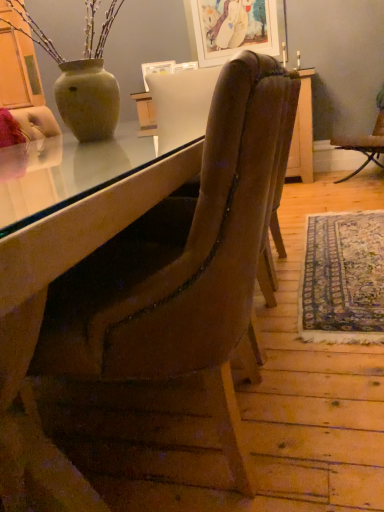
Where is `brown leather chair at right, the 1th chair in the back-to-front sequence`? This screenshot has width=384, height=512. brown leather chair at right, the 1th chair in the back-to-front sequence is located at coordinates (364, 145).

You are a GUI agent. You are given a task and a screenshot of the screen. Output one action in this format:
    pyautogui.click(x=<x>, y=<y>)
    Task: Click on the velvet brown chair at center, positioned as the second chair in right-to-left order
    The height and width of the screenshot is (512, 384).
    Given the screenshot: What is the action you would take?
    [143, 289]

Which object is positioned more to the right, blue patterned rug at lower right or matte white picture frame at upper center?

From the viewer's perspective, blue patterned rug at lower right appears more on the right side.

From the image's perspective, between blue patterned rug at lower right and matte white picture frame at upper center, which one is located above?

matte white picture frame at upper center appears higher in the image.

Between point (321, 289) and point (189, 34), which one is positioned in front?

The point (321, 289) is closer.

Would you say brown leather chair at right, arranged as the 1th chair when viewed from the top, is to the left or to the right of velvet brown chair at center, which is the first chair in left-to-right order, in the picture?

Clearly, brown leather chair at right, arranged as the 1th chair when viewed from the top, is on the right of velvet brown chair at center, which is the first chair in left-to-right order, in the image.

How much distance is there between brown leather chair at right, arranged as the second chair when ordered from the bottom, and velvet brown chair at center, which ranks as the first chair in front-to-back order?

The distance of brown leather chair at right, arranged as the second chair when ordered from the bottom, from velvet brown chair at center, which ranks as the first chair in front-to-back order, is 3.29 meters.

From the image's perspective, which one is positioned higher, brown leather chair at right, the second chair viewed from the front, or velvet brown chair at center, positioned as the second chair in right-to-left order?

brown leather chair at right, the second chair viewed from the front, is shown above in the image.

From the picture: Is brown leather chair at right, the second chair viewed from the front, not within velvet brown chair at center, marked as the second chair in a back-to-front arrangement?

Absolutely, brown leather chair at right, the second chair viewed from the front, is external to velvet brown chair at center, marked as the second chair in a back-to-front arrangement.

The height and width of the screenshot is (512, 384). I want to click on chair below the blue patterned rug at lower right (from the image's perspective), so click(143, 289).

From a real-world perspective, is blue patterned rug at lower right located beneath velvet brown chair at center, positioned as the second chair in right-to-left order?

Yes.

From the image's perspective, relative to velvet brown chair at center, marked as the second chair in a back-to-front arrangement, is blue patterned rug at lower right above or below?

blue patterned rug at lower right is above velvet brown chair at center, marked as the second chair in a back-to-front arrangement.

Which object is closer to the camera, blue patterned rug at lower right or velvet brown chair at center, marked as the second chair in a back-to-front arrangement?

velvet brown chair at center, marked as the second chair in a back-to-front arrangement.

Consider the image. Considering the sizes of objects blue patterned rug at lower right and brown leather chair at right, arranged as the second chair when ordered from the bottom, in the image provided, who is wider, blue patterned rug at lower right or brown leather chair at right, arranged as the second chair when ordered from the bottom,?

brown leather chair at right, arranged as the second chair when ordered from the bottom.

Is blue patterned rug at lower right smaller than brown leather chair at right, the second chair viewed from the front?

Indeed, blue patterned rug at lower right has a smaller size compared to brown leather chair at right, the second chair viewed from the front.

Does point (336, 327) come in front of point (375, 125)?

Yes, it is in front of point (375, 125).

From a real-world perspective, between matte white picture frame at upper center and brown leather chair at right, arranged as the 1th chair when viewed from the top, who is vertically lower?

brown leather chair at right, arranged as the 1th chair when viewed from the top, from a real-world perspective.

Based on the photo, does matte white picture frame at upper center have a lesser height compared to brown leather chair at right, arranged as the second chair when ordered from the bottom?

Yes.

Which of these two, matte white picture frame at upper center or brown leather chair at right, the 1th chair in the back-to-front sequence, is thinner?

Thinner between the two is matte white picture frame at upper center.

From the image's perspective, is matte white picture frame at upper center above or below brown leather chair at right, arranged as the second chair when ordered from the bottom?

Clearly, from the image's perspective, matte white picture frame at upper center is above brown leather chair at right, arranged as the second chair when ordered from the bottom.

Is brown leather chair at right, arranged as the second chair when ordered from the bottom, not near matte white picture frame at upper center?

That's right, there is a large distance between brown leather chair at right, arranged as the second chair when ordered from the bottom, and matte white picture frame at upper center.

From the image's perspective, relative to matte white picture frame at upper center, is brown leather chair at right, arranged as the 1th chair when viewed from the top, above or below?

From the image's perspective, brown leather chair at right, arranged as the 1th chair when viewed from the top, appears below matte white picture frame at upper center.

Can you confirm if brown leather chair at right, arranged as the second chair when ordered from the bottom, is positioned to the right of matte white picture frame at upper center?

Yes.

Is brown leather chair at right, the second chair viewed from the left, oriented towards matte white picture frame at upper center?

No, brown leather chair at right, the second chair viewed from the left, is not turned towards matte white picture frame at upper center.

Is matte white picture frame at upper center positioned before velvet brown chair at center, which appears as the first chair when ordered from the bottom?

No, matte white picture frame at upper center is behind velvet brown chair at center, which appears as the first chair when ordered from the bottom.

Is matte white picture frame at upper center placed right next to velvet brown chair at center, which appears as the first chair when ordered from the bottom?

No, matte white picture frame at upper center is not beside velvet brown chair at center, which appears as the first chair when ordered from the bottom.

Would you say matte white picture frame at upper center is inside or outside velvet brown chair at center, which ranks as the first chair in front-to-back order?

The correct answer is: outside.

Is matte white picture frame at upper center thinner than velvet brown chair at center, marked as the second chair in a back-to-front arrangement?

Yes.

What are the coordinates of `mat located underneath the matte white picture frame at upper center (from a real-world perspective)` in the screenshot? It's located at (343, 279).

This screenshot has height=512, width=384. In order to click on chair that appears below the brown leather chair at right, arranged as the second chair when ordered from the bottom (from the image's perspective) in this screenshot , I will do pos(143,289).

When comparing their distances from blue patterned rug at lower right, does matte white picture frame at upper center or brown leather chair at right, arranged as the second chair when ordered from the bottom, seem closer?

The object closer to blue patterned rug at lower right is brown leather chair at right, arranged as the second chair when ordered from the bottom.

Based on their spatial positions, is blue patterned rug at lower right or brown leather chair at right, the second chair viewed from the front, further from velvet brown chair at center, which is the 2th chair from top to bottom?

Among the two, brown leather chair at right, the second chair viewed from the front, is located further to velvet brown chair at center, which is the 2th chair from top to bottom.

When comparing their distances from matte white picture frame at upper center, does blue patterned rug at lower right or velvet brown chair at center, marked as the second chair in a back-to-front arrangement, seem closer?

Among the two, blue patterned rug at lower right is located nearer to matte white picture frame at upper center.

From the image, which object appears to be farther from blue patterned rug at lower right, velvet brown chair at center, which is the 2th chair from top to bottom, or brown leather chair at right, arranged as the 1th chair when viewed from the top?

brown leather chair at right, arranged as the 1th chair when viewed from the top, is positioned further to the anchor blue patterned rug at lower right.

Estimate the real-world distances between objects in this image. Which object is further from blue patterned rug at lower right, velvet brown chair at center, which is the first chair in left-to-right order, or matte white picture frame at upper center?

Among the two, matte white picture frame at upper center is located further to blue patterned rug at lower right.

Estimate the real-world distances between objects in this image. Which object is further from brown leather chair at right, the first chair positioned from the right, matte white picture frame at upper center or blue patterned rug at lower right?

blue patterned rug at lower right.

Looking at the image, which one is located further to brown leather chair at right, the first chair positioned from the right, velvet brown chair at center, marked as the second chair in a back-to-front arrangement, or blue patterned rug at lower right?

velvet brown chair at center, marked as the second chair in a back-to-front arrangement, is further to brown leather chair at right, the first chair positioned from the right.

Which object lies further to the anchor point velvet brown chair at center, which is the first chair in left-to-right order, matte white picture frame at upper center or blue patterned rug at lower right?

matte white picture frame at upper center is further to velvet brown chair at center, which is the first chair in left-to-right order.

Find the location of a particular element. The image size is (384, 512). chair positioned between blue patterned rug at lower right and matte white picture frame at upper center from near to far is located at coordinates (364, 145).

The height and width of the screenshot is (512, 384). What are the coordinates of `mat between velvet brown chair at center, which appears as the first chair when ordered from the bottom, and brown leather chair at right, the second chair viewed from the left, in the front-back direction` in the screenshot? It's located at point(343,279).

Find the location of a particular element. mat located between velvet brown chair at center, marked as the second chair in a back-to-front arrangement, and matte white picture frame at upper center in the depth direction is located at coordinates (343, 279).

Identify the location of chair located between velvet brown chair at center, which is the 2th chair from top to bottom, and matte white picture frame at upper center in the depth direction. [x=364, y=145].